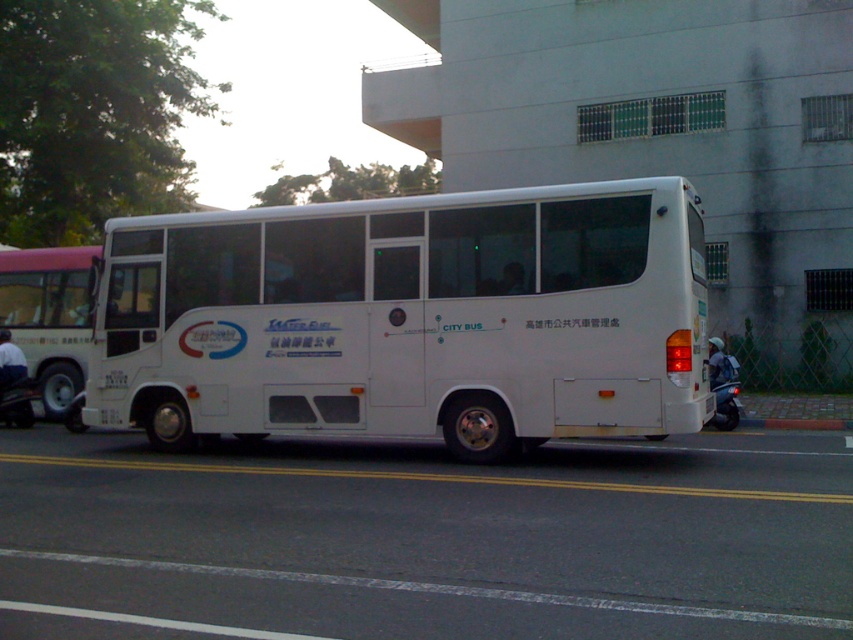
You are a city planner analyzing bus sizes for parking spaces. You observe the white matte bus at center and the white matte bus at left in the image. Which bus requires a shorter parking space due to its size?

The white matte bus at center requires a shorter parking space because its width is less than the white matte bus at left, meaning it is smaller in size.

You are a pedestrian standing on the sidewalk and see both the white matte bus at center and the white matte bus at left. Which bus is closer to the yellow edge line on the road?

The white matte bus at center is positioned on the right side of the white matte bus at left, so the white matte bus at center is closer to the yellow edge line on the road.